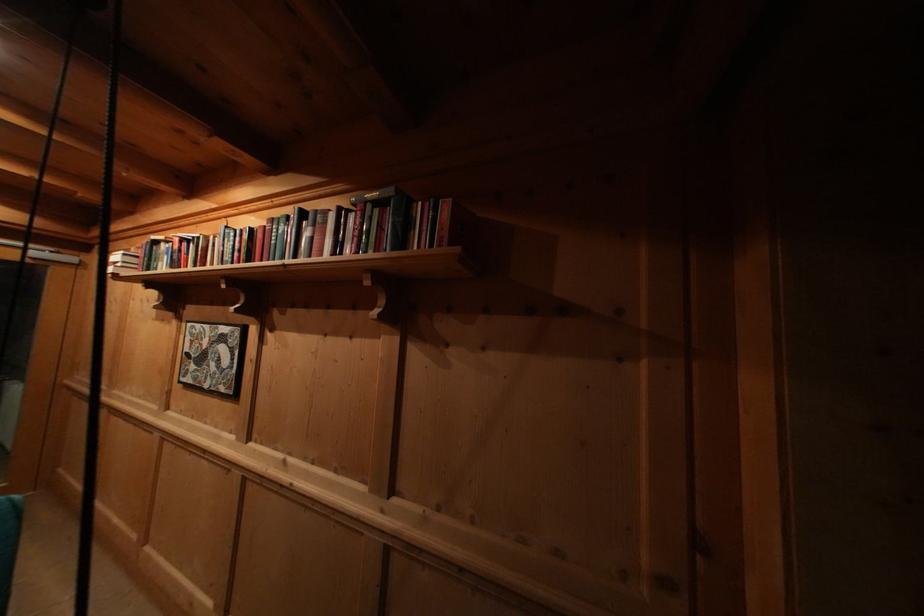
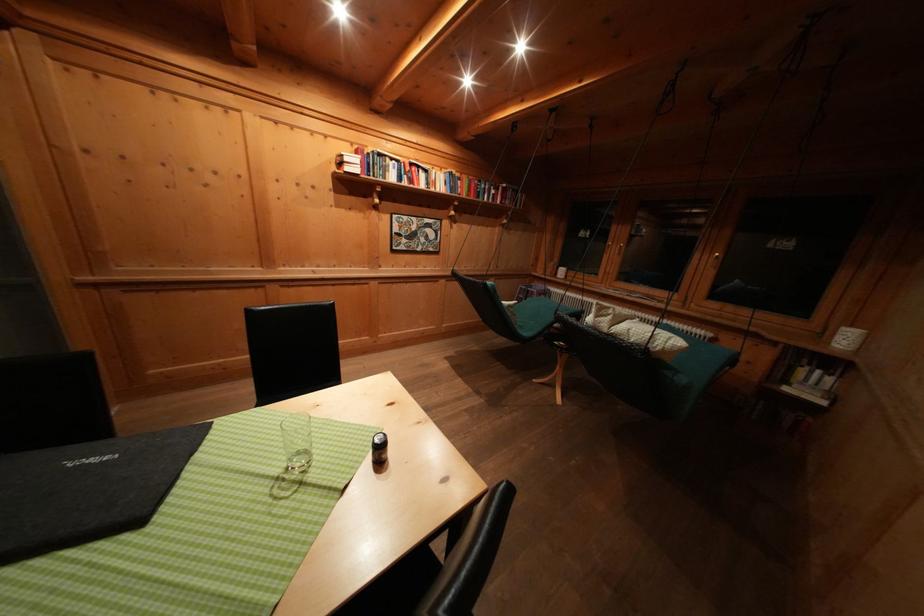
In the second image, find the point that corresponds to point (188, 246) in the first image.

(418, 169)